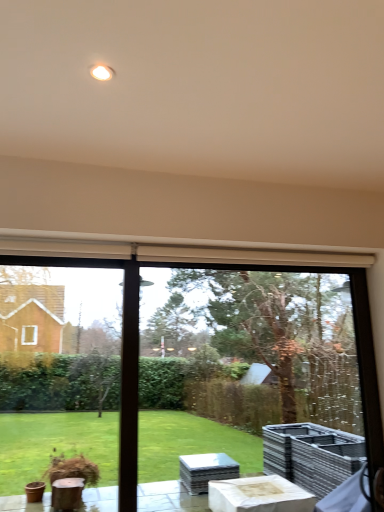
This screenshot has height=512, width=384. What do you see at coordinates (121, 359) in the screenshot?
I see `clear glass window at center` at bounding box center [121, 359].

Find the location of a particular element. The image size is (384, 512). clear glass window at center is located at coordinates (121, 359).

The width and height of the screenshot is (384, 512). Find the location of `clear glass window at center`. clear glass window at center is located at coordinates (121, 359).